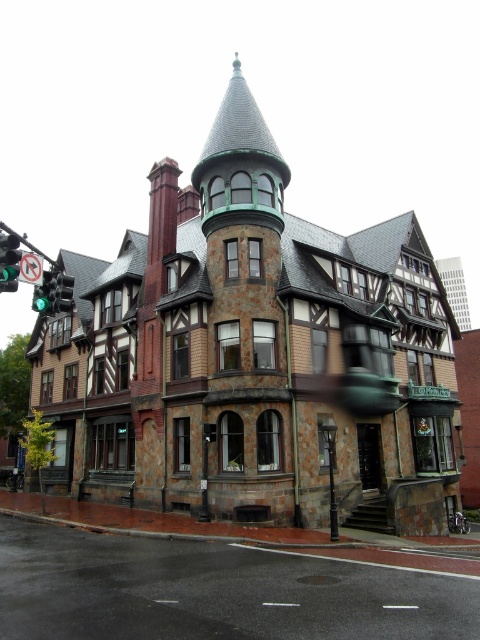
You are standing at the corner of the Victorian building and want to walk towards the point labeled as point (x=64, y=291). There is an obstacle at point (x=180, y=564). Will you encounter the obstacle before reaching your destination?

Since point (x=180, y=564) is behind point (x=64, y=291), you will reach your destination at point (x=64, y=291) before encountering the obstacle at point (x=180, y=564), so you will not encounter the obstacle first.

You are a pedestrian standing on the sidewalk in front of the Victorian building. You need to cross the dark asphalt road at lower center. To do so safely, you must ensure the green glass traffic light at left is showing a walk signal. However, you notice the traffic light is currently facing away from you. Can you see the traffic light from your current position? Explain why or why not based on their positions.

The dark asphalt road at lower center is located below the green glass traffic light at left. Since the road is below the traffic light, the traffic light is positioned higher up or above the road. If you are standing on the sidewalk in front of the building, the traffic light at left is likely elevated and facing the road, so you might not see its signal directly from your position in front of the building. The traffic light might be facing the direction of oncoming traffic rather than pedestrians on the